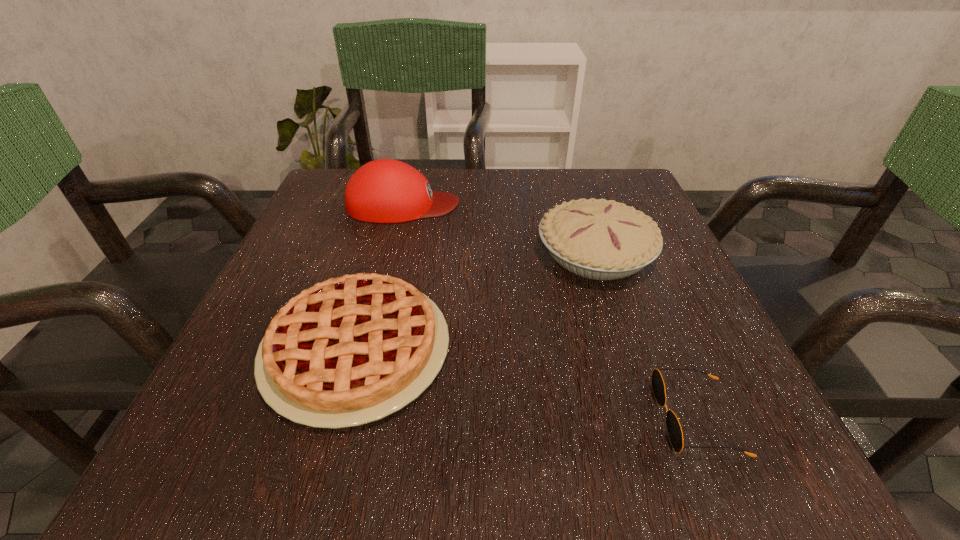
Find the location of a particular element. The image size is (960, 540). free space located on the front-facing side of the sunglasses is located at coordinates (583, 417).

The width and height of the screenshot is (960, 540). I want to click on free space located 0.230m on the front-facing side of the sunglasses, so click(x=484, y=417).

Where is `baseball cap positioned at the far edge`? baseball cap positioned at the far edge is located at coordinates (385, 190).

At what (x,y) coordinates should I click in order to perform the action: click on pie at the far edge. Please return your answer as a coordinate pair (x, y). Looking at the image, I should click on (598, 239).

You are a GUI agent. You are given a task and a screenshot of the screen. Output one action in this format:
    pyautogui.click(x=<x>, y=<y>)
    Task: Click on the pie located at the near edge
    Image resolution: width=960 pixels, height=540 pixels.
    Given the screenshot: What is the action you would take?
    pyautogui.click(x=351, y=350)

Find the location of a particular element. sunglasses at the near edge is located at coordinates (674, 429).

The image size is (960, 540). I want to click on baseball cap present at the left edge, so point(385,190).

Image resolution: width=960 pixels, height=540 pixels. Find the location of `pie at the left edge`. pie at the left edge is located at coordinates (351, 350).

The image size is (960, 540). What are the coordinates of `pie positioned at the right edge` in the screenshot? It's located at (598, 239).

You are a GUI agent. You are given a task and a screenshot of the screen. Output one action in this format:
    pyautogui.click(x=<x>, y=<y>)
    Task: Click on the sunglasses located in the right edge section of the desktop
    The height and width of the screenshot is (540, 960).
    Given the screenshot: What is the action you would take?
    pyautogui.click(x=674, y=429)